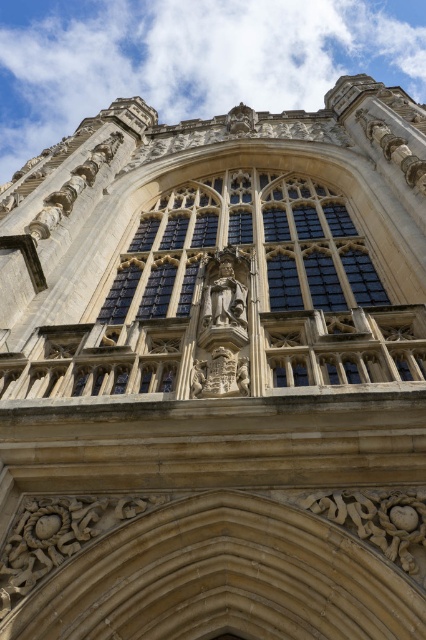
Does point (221, 301) lie behind point (247, 374)?

Yes, point (221, 301) is farther from viewer.

Image resolution: width=426 pixels, height=640 pixels. I want to click on matte stone statue at center, so click(x=224, y=291).

Which is above, dark glass window at center or carved stone statue at center?

Positioned higher is dark glass window at center.

Between point (175, 305) and point (224, 376), which one is positioned behind?

Positioned behind is point (175, 305).

Where is `dark glass window at center`? The width and height of the screenshot is (426, 640). dark glass window at center is located at coordinates (244, 246).

Is point (173, 268) farther from camera compared to point (232, 259)?

Yes, it is behind point (232, 259).

Based on the photo, between dark glass window at center and matte stone statue at center, which one appears on the left side from the viewer's perspective?

matte stone statue at center

I want to click on dark glass window at center, so click(x=244, y=246).